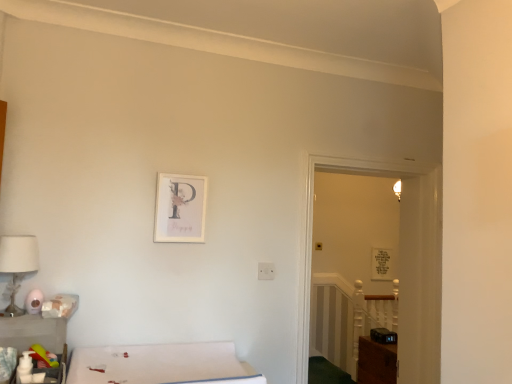
This screenshot has width=512, height=384. What do you see at coordinates (349, 258) in the screenshot?
I see `clear glass door at center` at bounding box center [349, 258].

Where is `white matte picture frame at upper center, which appears as the first picture frame when viewed from the left`? The image size is (512, 384). white matte picture frame at upper center, which appears as the first picture frame when viewed from the left is located at coordinates (180, 208).

Is white fabric bed at lower left located outside rubber yellow toy at lower left?

white fabric bed at lower left lies outside rubber yellow toy at lower left's area.

This screenshot has width=512, height=384. Identify the location of furniture located in front of the rubber yellow toy at lower left. (161, 364).

Which of these two, white fabric bed at lower left or rubber yellow toy at lower left, stands taller?

white fabric bed at lower left is taller.

Is white fabric bed at lower left closer to the viewer compared to rubber yellow toy at lower left?

Yes, it is in front of rubber yellow toy at lower left.

Looking at the image, does white matte picture frame at upper center, the 2th picture frame when ordered from bottom to top, seem bigger or smaller compared to white fabric lampshade at left?

In the image, white matte picture frame at upper center, the 2th picture frame when ordered from bottom to top, appears to be smaller than white fabric lampshade at left.

In the image, there is a white matte picture frame at upper center, which appears as the first picture frame when viewed from the left. Identify the location of table lamp below it (from the image's perspective). (17, 265).

Which of these two, white matte picture frame at upper center, which appears as the first picture frame when viewed from the front, or white fabric lampshade at left, stands taller?

white matte picture frame at upper center, which appears as the first picture frame when viewed from the front.

Which is in front, point (206, 183) or point (8, 284)?

The point (8, 284) is closer.

Looking at this image, is there a large distance between clear glass door at center and matte plastic toiletries at lower left, marked as the 1th table in a back-to-front arrangement?

Yes, clear glass door at center is far from matte plastic toiletries at lower left, marked as the 1th table in a back-to-front arrangement.

Would you say clear glass door at center contains matte plastic toiletries at lower left, arranged as the 2th table when viewed from the front?

No, matte plastic toiletries at lower left, arranged as the 2th table when viewed from the front, is not inside clear glass door at center.

From their relative heights in the image, would you say clear glass door at center is taller or shorter than matte plastic toiletries at lower left, arranged as the 2th table when viewed from the front?

clear glass door at center is taller than matte plastic toiletries at lower left, arranged as the 2th table when viewed from the front.

Does point (45, 356) come behind point (391, 202)?

No, it is in front of (391, 202).

Is rubber yellow toy at lower left looking in the opposite direction of clear glass door at center?

No, rubber yellow toy at lower left's orientation is not away from clear glass door at center.

How different are the orientations of rubber yellow toy at lower left and clear glass door at center in degrees?

The angle between the facing direction of rubber yellow toy at lower left and the facing direction of clear glass door at center is 3.06 degrees.

Is rubber yellow toy at lower left wider or thinner than clear glass door at center?

In the image, rubber yellow toy at lower left appears to be more narrow than clear glass door at center.

Is white fabric lampshade at left positioned beyond the bounds of matte white picture frame at upper center, arranged as the second picture frame when viewed from the front?

Absolutely, white fabric lampshade at left is external to matte white picture frame at upper center, arranged as the second picture frame when viewed from the front.

Is white fabric lampshade at left positioned with its back to matte white picture frame at upper center, the second picture frame from the top?

No, white fabric lampshade at left is not facing away from matte white picture frame at upper center, the second picture frame from the top.

Image resolution: width=512 pixels, height=384 pixels. What are the coordinates of `picture frame below the white fabric lampshade at left (from the image's perspective)` in the screenshot? It's located at (382, 264).

Between point (388, 277) and point (76, 377), which one is positioned behind?

The point (388, 277) is behind.

From a real-world perspective, which is physically below, matte white picture frame at upper center, placed as the 1th picture frame when sorted from back to front, or white fabric bed at lower left?

white fabric bed at lower left is physically lower.

Is matte white picture frame at upper center, the first picture frame positioned from the bottom, inside or outside of white fabric bed at lower left?

matte white picture frame at upper center, the first picture frame positioned from the bottom, cannot be found inside white fabric bed at lower left.

Does matte white picture frame at upper center, which ranks as the 1th picture frame in right-to-left order, have a greater width compared to white fabric bed at lower left?

Incorrect, the width of matte white picture frame at upper center, which ranks as the 1th picture frame in right-to-left order, does not surpass that of white fabric bed at lower left.

Is point (48, 366) behind point (31, 241)?

No.

Does rubber yellow toy at lower left turn towards white fabric lampshade at left?

No, rubber yellow toy at lower left is not turned towards white fabric lampshade at left.

Is rubber yellow toy at lower left behind white fabric lampshade at left?

No, rubber yellow toy at lower left is in front of white fabric lampshade at left.

Is rubber yellow toy at lower left wider or thinner than white fabric lampshade at left?

In the image, rubber yellow toy at lower left appears to be more narrow than white fabric lampshade at left.

At what (x,y) coordinates should I click in order to perform the action: click on toy above the white fabric bed at lower left (from the image's perspective). Please return your answer as a coordinate pair (x, y). The height and width of the screenshot is (384, 512). Looking at the image, I should click on (42, 356).

The height and width of the screenshot is (384, 512). I want to click on picture frame above the white fabric lampshade at left (from a real-world perspective), so click(x=180, y=208).

Considering their positions, is clear glass door at center positioned closer to rubber yellow toy at lower left than white matte picture frame at upper center, which appears as the first picture frame when viewed from the front?

Based on the image, white matte picture frame at upper center, which appears as the first picture frame when viewed from the front, appears to be nearer to rubber yellow toy at lower left.

Considering their positions, is white fabric bed at lower left positioned closer to matte plastic toiletries at lower left, marked as the 1th table in a back-to-front arrangement, than white matte picture frame at upper center, which appears as the first picture frame when viewed from the left?

Based on the image, white fabric bed at lower left appears to be nearer to matte plastic toiletries at lower left, marked as the 1th table in a back-to-front arrangement.

Looking at the image, which one is located further to matte plastic toiletries at lower left, marked as the 1th table in a back-to-front arrangement, white fabric bed at lower left or rubber yellow toy at lower left?

Based on the image, white fabric bed at lower left appears to be further to matte plastic toiletries at lower left, marked as the 1th table in a back-to-front arrangement.

Considering their positions, is white fabric bed at lower left positioned further to rubber yellow toy at lower left than clear glass door at center?

The object further to rubber yellow toy at lower left is clear glass door at center.

Estimate the real-world distances between objects in this image. Which object is further from white matte picture frame at upper center, which appears as the 1th picture frame when viewed from the top, matte plastic toiletries at lower left, arranged as the 2th table when viewed from the front, or rubber yellow toy at lower left?

Among the two, rubber yellow toy at lower left is located further to white matte picture frame at upper center, which appears as the 1th picture frame when viewed from the top.

Based on their spatial positions, is matte plastic toiletries at lower left, marked as the 1th table in a back-to-front arrangement, or white fabric bed at lower left closer to matte white picture frame at upper center, the second picture frame from the top?

white fabric bed at lower left.

Based on their spatial positions, is white matte picture frame at upper center, the 2th picture frame in the right-to-left sequence, or white fabric lampshade at left closer to clear glass door at center?

white matte picture frame at upper center, the 2th picture frame in the right-to-left sequence, lies closer to clear glass door at center than the other object.

Looking at the image, which one is located further to white fabric lampshade at left, matte plastic toiletries at lower left, marked as the 1th table in a back-to-front arrangement, or white fabric bed at lower left?

white fabric bed at lower left lies further to white fabric lampshade at left than the other object.

Image resolution: width=512 pixels, height=384 pixels. I want to click on glass door between white fabric bed at lower left and matte white picture frame at upper center, the second picture frame from the top, along the z-axis, so click(349, 258).

Identify the location of picture frame between white fabric bed at lower left and clear glass door at center. (180, 208).

Locate an element on the screen. The image size is (512, 384). picture frame positioned between white fabric bed at lower left and matte white picture frame at upper center, arranged as the second picture frame when viewed from the front, from near to far is located at coordinates (180, 208).

At what (x,y) coordinates should I click in order to perform the action: click on toy between matte plastic toiletries at lower left, arranged as the 2th table when viewed from the front, and clear glass door at center from left to right. Please return your answer as a coordinate pair (x, y). The height and width of the screenshot is (384, 512). Looking at the image, I should click on (42, 356).